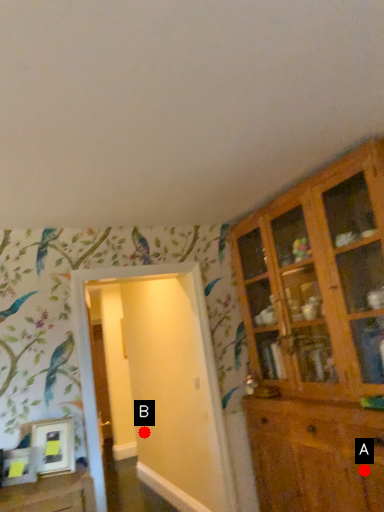
Question: Two points are circled on the image, labeled by A and B beside each circle. Which point is farther from the camera taking this photo?

Choices:
 (A) A is further
 (B) B is further

Answer: (B)